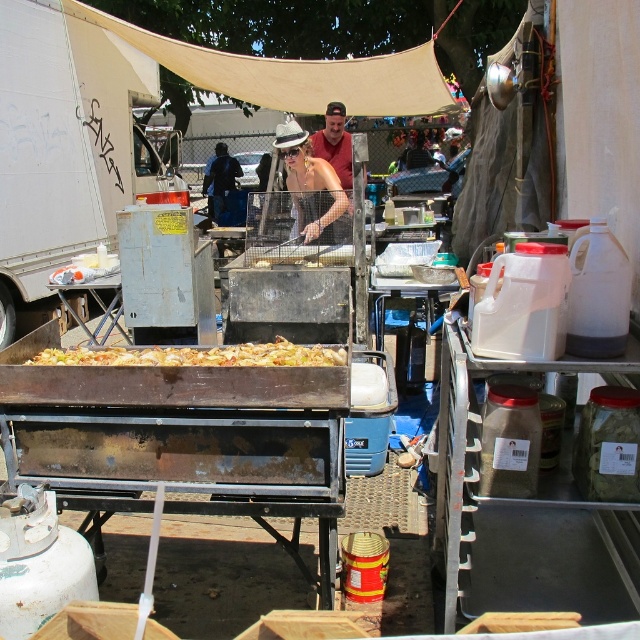
Question: Is golden brown crispy food at center in front of matte red shirt at center?

Choices:
 (A) no
 (B) yes

Answer: (B)

Question: Does golden brown crispy food at center have a larger size compared to matte red shirt at center?

Choices:
 (A) no
 (B) yes

Answer: (A)

Question: Which object is closer to the camera taking this photo?

Choices:
 (A) golden brown crispy food at center
 (B) matte red shirt at center

Answer: (A)

Question: Is golden brown crispy food at center in front of matte red shirt at center?

Choices:
 (A) no
 (B) yes

Answer: (B)

Question: Which point is closer to the camera taking this photo?

Choices:
 (A) (332, 102)
 (B) (198, 364)

Answer: (B)